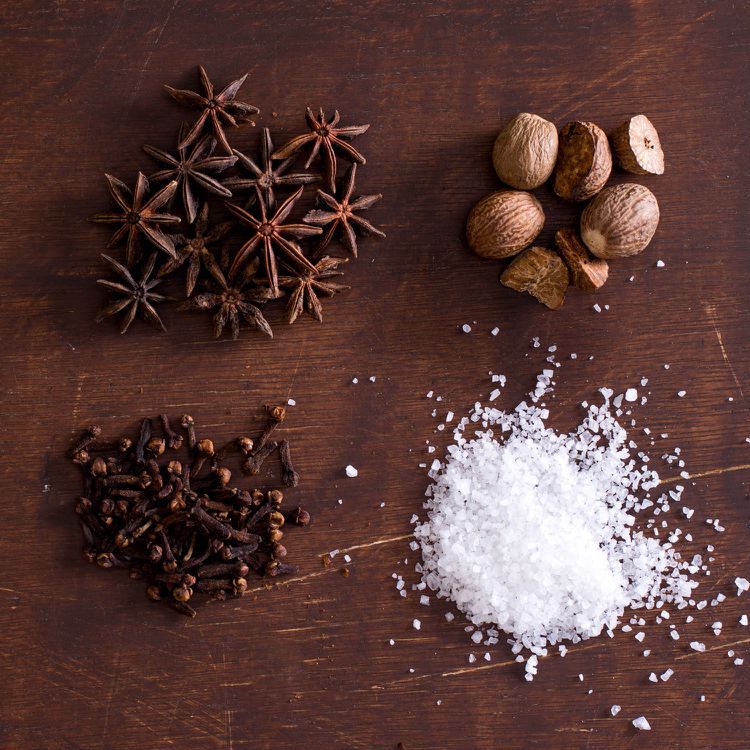
You are a GUI agent. You are given a task and a screenshot of the screen. Output one action in this format:
    pyautogui.click(x=<x>, y=<y>)
    Task: Click on the wood surface
    
    Given the screenshot: What is the action you would take?
    click(376, 350)